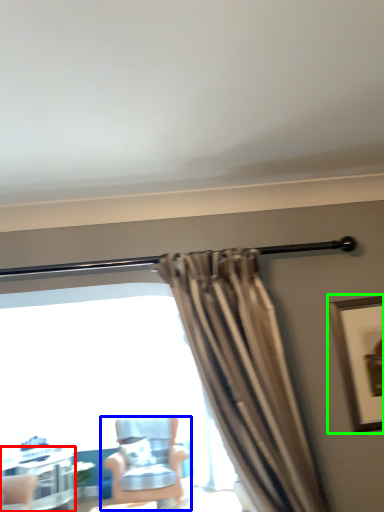
Question: Estimate the real-world distances between objects in this image. Which object is farther from table (highlighted by a red box), chair (highlighted by a blue box) or picture frame (highlighted by a green box)?

Choices:
 (A) chair
 (B) picture frame

Answer: (B)